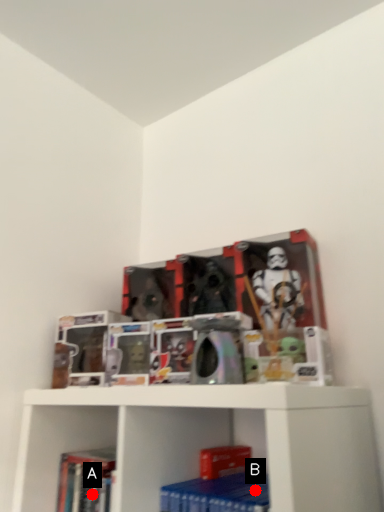
Question: Two points are circled on the image, labeled by A and B beside each circle. Which of the following is the closest to the observer?

Choices:
 (A) A is closer
 (B) B is closer

Answer: (B)